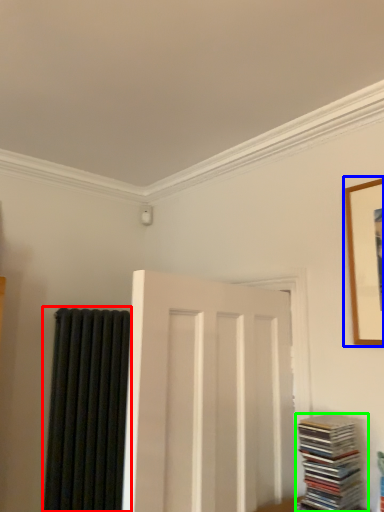
Question: Based on their relative distances, which object is nearer to curtain (highlighted by a red box)? Choose from picture frame (highlighted by a blue box) and book (highlighted by a green box).

Choices:
 (A) picture frame
 (B) book

Answer: (B)